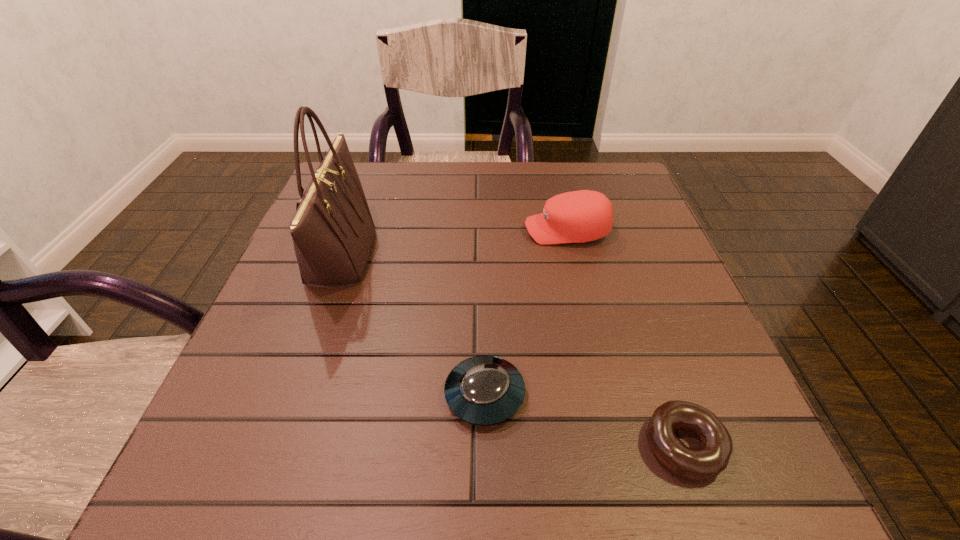
At what (x,y) coordinates should I click in order to perform the action: click on vacant position in the image that satisfies the following two spatial constraints: 1. on the front-facing side of the second object from left to right; 2. on the right side of the leftmost object. Please return your answer as a coordinate pair (x, y). This screenshot has width=960, height=540. Looking at the image, I should click on 291,395.

Locate an element on the screen. This screenshot has width=960, height=540. vacant point that satisfies the following two spatial constraints: 1. on the front-facing side of the doughnut; 2. on the right side of the third shortest object is located at coordinates (618, 445).

At what (x,y) coordinates should I click in order to perform the action: click on free space that satisfies the following two spatial constraints: 1. on the front-facing side of the second object from left to right; 2. on the right side of the handbag. Please return your answer as a coordinate pair (x, y). Looking at the image, I should click on (291, 395).

Find the location of a particular element. free spot that satisfies the following two spatial constraints: 1. on the front-facing side of the second tallest object; 2. on the left side of the doughnut is located at coordinates (618, 445).